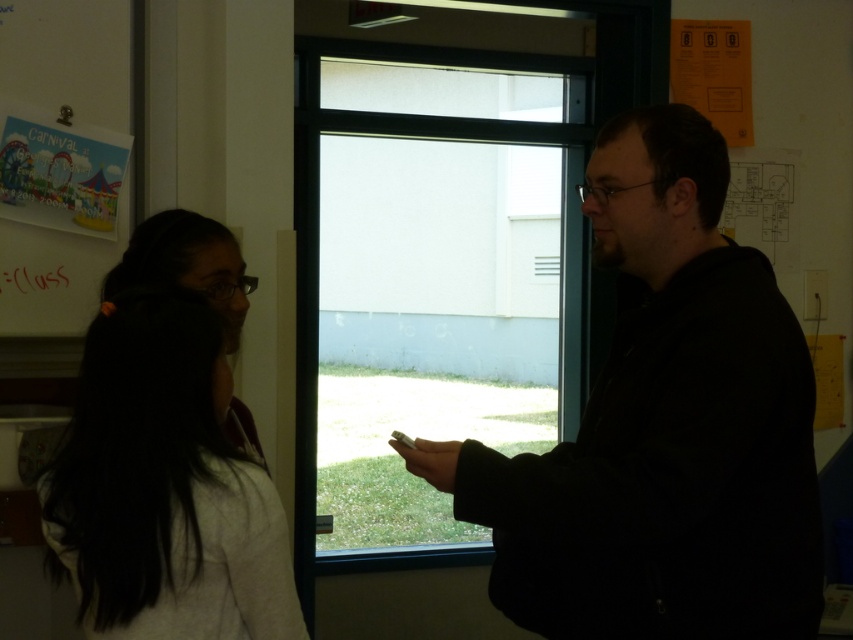
You are an office worker trying to locate your black matte jacket at right. You are currently standing near the whiteboard on the left side of the room. Which direction should you move to find it?

The black matte jacket at right is located at point (662, 428), so you should move towards the right side of the room to find it.